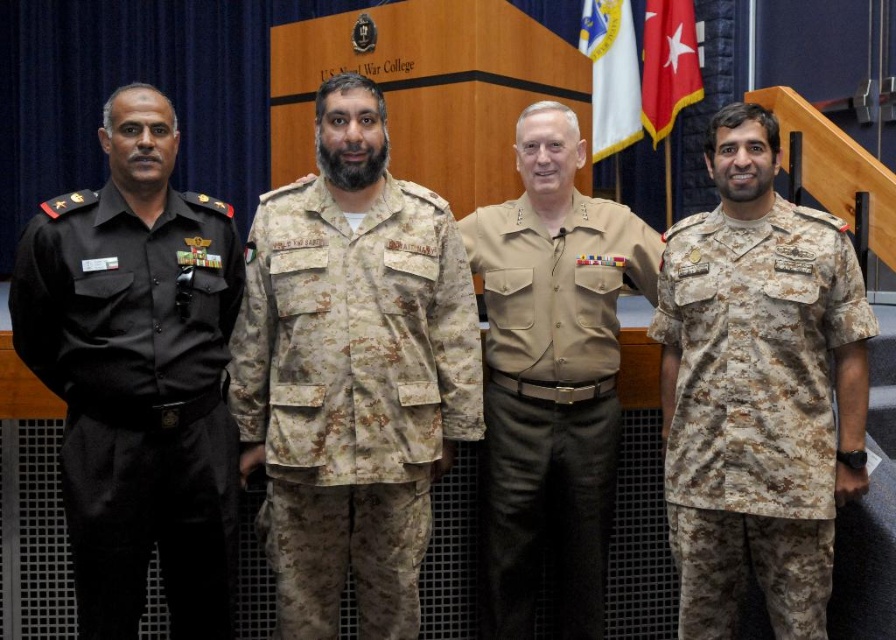
Based on the scene description, where is the camouflage fabric uniform at center located in terms of coordinates?

The camouflage fabric uniform at center is located at coordinates point (x=352, y=394).

In the scene described, which object is positioned to the left of the other between the camouflage fabric uniform at center and the red fabric flag at upper right?

The camouflage fabric uniform at center is positioned to the left of the red fabric flag at upper right.

In the scene described, there are a camouflage fabric uniform at center and a white fabric flag at upper center. Which object has a greater width?

The camouflage fabric uniform at center has a greater width than the white fabric flag at upper center according to the description.